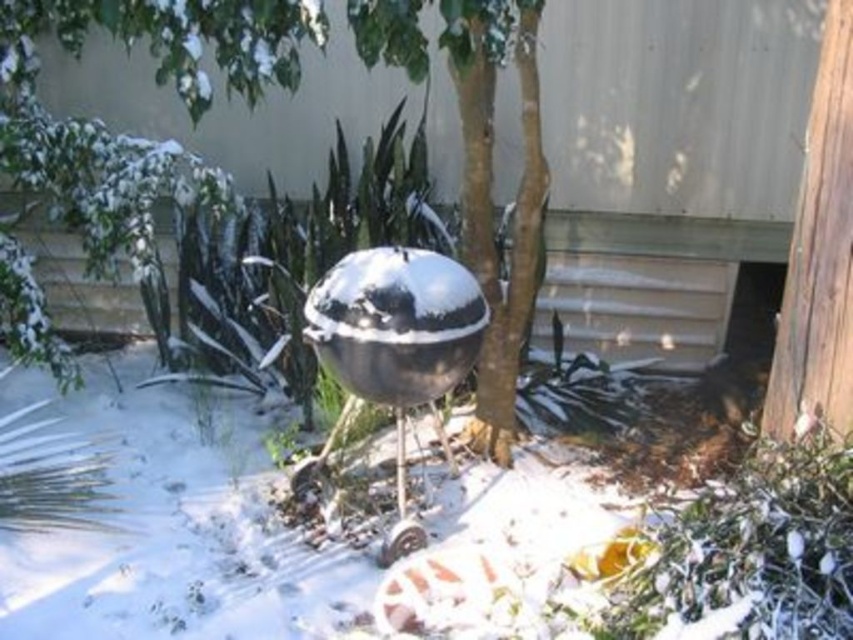
Is green leafy tree at center to the right of shiny metallic sphere at center from the viewer's perspective?

Correct, you'll find green leafy tree at center to the right of shiny metallic sphere at center.

Who is positioned more to the left, green leafy tree at center or shiny metallic sphere at center?

Positioned to the left is shiny metallic sphere at center.

Between point (546, 168) and point (474, 332), which one is positioned behind?

The point (546, 168) is more distant.

This screenshot has height=640, width=853. Identify the location of green leafy tree at center. (490, 195).